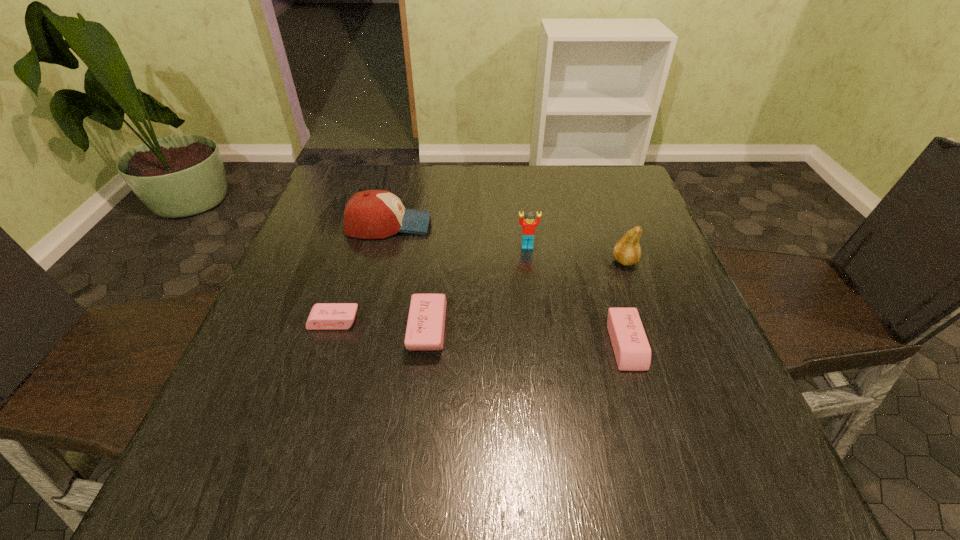
Find the location of a particular element. The height and width of the screenshot is (540, 960). the shortest eraser is located at coordinates (324, 316).

Where is `the leftmost eraser`? The image size is (960, 540). the leftmost eraser is located at coordinates (x=324, y=316).

Locate an element on the screen. the second eraser from right to left is located at coordinates (425, 328).

The width and height of the screenshot is (960, 540). What are the coordinates of `the tallest eraser` in the screenshot? It's located at (425, 328).

Find the location of a particular element. the second shortest eraser is located at coordinates (632, 351).

You are a GUI agent. You are given a task and a screenshot of the screen. Output one action in this format:
    pyautogui.click(x=<x>, y=<y>)
    Task: Click on the fifth tallest object
    
    Given the screenshot: What is the action you would take?
    pyautogui.click(x=632, y=351)

Where is `baseball cap`? The image size is (960, 540). baseball cap is located at coordinates (372, 214).

Image resolution: width=960 pixels, height=540 pixels. I want to click on Lego, so click(x=529, y=223).

Where is `the fourth object from left to right`? The image size is (960, 540). the fourth object from left to right is located at coordinates (529, 223).

Identify the location of pear. This screenshot has width=960, height=540. click(x=627, y=251).